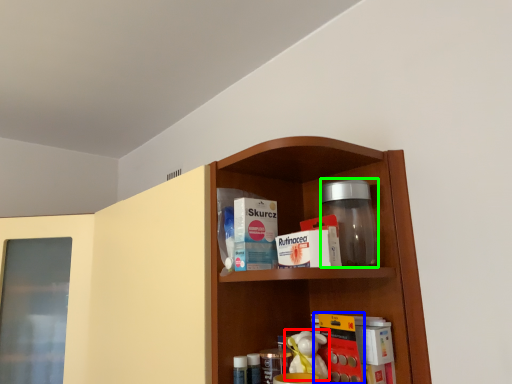
Question: Considering the real-world distances, which object is farthest from toy (highlighted by a red box)? book (highlighted by a blue box) or glass jar (highlighted by a green box)?

Choices:
 (A) book
 (B) glass jar

Answer: (B)